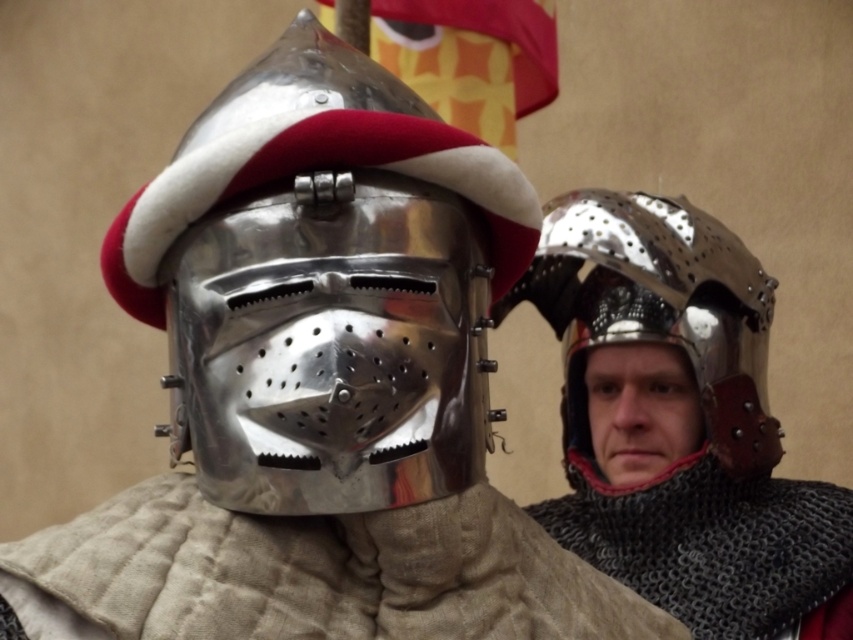
You are a medieval knight inspecting two helmets in your inventory. You have a shiny metallic helmet at center and a shiny metallic helmet at right. Which helmet has a smaller width?

The shiny metallic helmet at center has a lesser width compared to the shiny metallic helmet at right, so the shiny metallic helmet at center is smaller in width.

You are a knight at a medieval tournament, and you need to pass between the shiny metallic helmet at center and the shiny metallic helmet at right. Your shield is 3 feet wide. Can you safely navigate through the gap without touching either helmet?

The distance between the shiny metallic helmet at center and the shiny metallic helmet at right is 37.67 inches. Since 3 feet equals 36 inches, your shield can fit through the gap as 37.67 inches is wider than 36 inches.